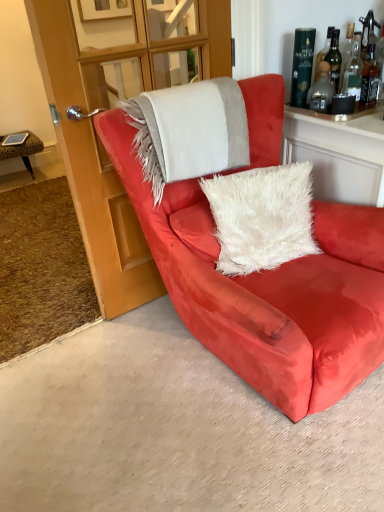
Question: Considering the relative sizes of transparent glass door at upper center and satin red armchair at center in the image provided, is transparent glass door at upper center bigger than satin red armchair at center?

Choices:
 (A) yes
 (B) no

Answer: (B)

Question: Is transparent glass door at upper center turned away from satin red armchair at center?

Choices:
 (A) no
 (B) yes

Answer: (B)

Question: Is there a large distance between transparent glass door at upper center and satin red armchair at center?

Choices:
 (A) no
 (B) yes

Answer: (A)

Question: Can you confirm if transparent glass door at upper center is positioned to the right of satin red armchair at center?

Choices:
 (A) yes
 (B) no

Answer: (B)

Question: Is transparent glass door at upper center taller than satin red armchair at center?

Choices:
 (A) no
 (B) yes

Answer: (B)

Question: Considering the positions of point (316, 82) and point (299, 57), is point (316, 82) closer or farther from the camera than point (299, 57)?

Choices:
 (A) closer
 (B) farther

Answer: (B)

Question: From a real-world perspective, is translucent glass bottle at upper right, which is the 2th bottle from right to left, physically located above or below green glass bottle at upper right, which is counted as the 1th bottle, starting from the left?

Choices:
 (A) below
 (B) above

Answer: (A)

Question: Looking at the image, does translucent glass bottle at upper right, which is the 2th bottle from right to left, seem bigger or smaller compared to green glass bottle at upper right, arranged as the third bottle when viewed from the right?

Choices:
 (A) small
 (B) big

Answer: (A)

Question: In the image, is translucent glass bottle at upper right, which is the 2th bottle from right to left, positioned in front of or behind green glass bottle at upper right, arranged as the third bottle when viewed from the right?

Choices:
 (A) front
 (B) behind

Answer: (A)

Question: Is point (327, 88) positioned closer to the camera than point (379, 75)?

Choices:
 (A) farther
 (B) closer

Answer: (A)

Question: In terms of width, does translucent glass bottle at upper right, which is the 2th bottle from right to left, look wider or thinner when compared to translucent amber glass bottle at upper right, the 1th bottle in the right-to-left sequence?

Choices:
 (A) wide
 (B) thin

Answer: (A)

Question: Is translucent glass bottle at upper right, the 2th bottle when ordered from left to right, spatially inside translucent amber glass bottle at upper right, the 1th bottle in the right-to-left sequence, or outside of it?

Choices:
 (A) outside
 (B) inside

Answer: (A)

Question: Relative to translucent amber glass bottle at upper right, which appears as the 3th bottle when viewed from the left, is translucent glass bottle at upper right, the 2th bottle when ordered from left to right, in front or behind?

Choices:
 (A) front
 (B) behind

Answer: (A)

Question: Considering the positions of transparent glass door at upper center and green glass bottle at upper right, which is counted as the 1th bottle, starting from the left, in the image, is transparent glass door at upper center bigger or smaller than green glass bottle at upper right, which is counted as the 1th bottle, starting from the left,?

Choices:
 (A) small
 (B) big

Answer: (B)

Question: Is point (66, 62) positioned closer to the camera than point (294, 103)?

Choices:
 (A) closer
 (B) farther

Answer: (A)